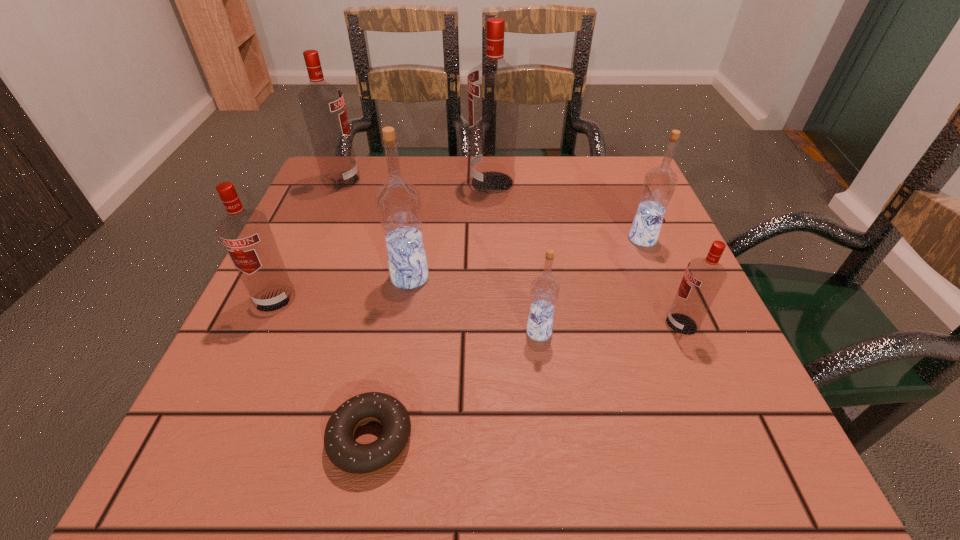
Where is `free space at the right edge`? This screenshot has height=540, width=960. free space at the right edge is located at coordinates (644, 337).

The height and width of the screenshot is (540, 960). In order to click on vacant space at the far left corner of the desktop in this screenshot , I will do tap(313, 207).

Locate an element on the screen. free point at the far right corner is located at coordinates (622, 183).

In the image, there is a desktop. Identify the location of vacant space at the near right corner. (714, 463).

The width and height of the screenshot is (960, 540). What are the coordinates of `free spot between the second smallest red vodka and the sixth nearest object` in the screenshot? It's located at (459, 269).

Find the location of a particular element. vacant region between the third smallest red vodka and the fifth vodka from right to left is located at coordinates (375, 229).

Where is `unoccupied position between the second blue vodka from right to left and the second nearest blue vodka`? unoccupied position between the second blue vodka from right to left and the second nearest blue vodka is located at coordinates (474, 305).

Find the location of a particular element. This screenshot has height=540, width=960. free space that is in between the smallest blue vodka and the smallest red vodka is located at coordinates (611, 328).

Identify the location of vacant space that is in between the third vodka from left to right and the second biggest red vodka. (375, 229).

What are the coordinates of `empty space between the third smallest red vodka and the third biggest red vodka` in the screenshot? It's located at (308, 240).